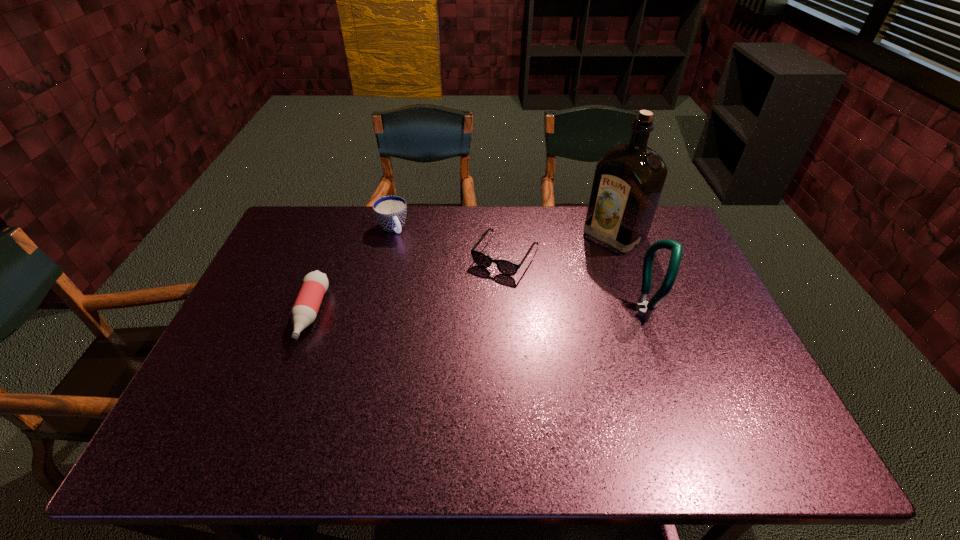
You are a GUI agent. You are given a task and a screenshot of the screen. Output one action in this format:
    pyautogui.click(x=<x>, y=<y>)
    Task: Click on the vacant region between the bottle opener and the second shortest object
    
    Given the screenshot: What is the action you would take?
    pyautogui.click(x=479, y=313)

You are a GUI agent. You are given a task and a screenshot of the screen. Output one action in this format:
    pyautogui.click(x=<x>, y=<y>)
    Task: Click on the free space between the sunglasses and the fourth shortest object
    The width and height of the screenshot is (960, 540).
    Given the screenshot: What is the action you would take?
    pyautogui.click(x=576, y=284)

Where is `free space between the leftmost object and the fourth object from right to left`? The width and height of the screenshot is (960, 540). free space between the leftmost object and the fourth object from right to left is located at coordinates (351, 271).

At what (x,y) coordinates should I click in order to perform the action: click on vacant area that lies between the bottle opener and the sunglasses. Please return your answer as a coordinate pair (x, y). The width and height of the screenshot is (960, 540). Looking at the image, I should click on (576, 284).

Where is `vacant space that is in between the liquor and the cup`? vacant space that is in between the liquor and the cup is located at coordinates (504, 232).

Find the location of a particular element. blank region between the shortest object and the bottle is located at coordinates (408, 285).

Identify the location of free space between the bottle and the third object from left to right. (408, 285).

Where is `vacant space that is in between the cup and the shortest object`? Image resolution: width=960 pixels, height=540 pixels. vacant space that is in between the cup and the shortest object is located at coordinates (448, 242).

Find the location of `empty space that is in between the third object from right to left and the cup`. empty space that is in between the third object from right to left and the cup is located at coordinates (448, 242).

Locate which object is the third closest to the second shortest object. Please provide its 2D coordinates. Your answer should be formatted as a tuple, i.e. [(x, y)], where the tuple contains the x and y coordinates of a point satisfying the conditions above.

[(628, 181)]